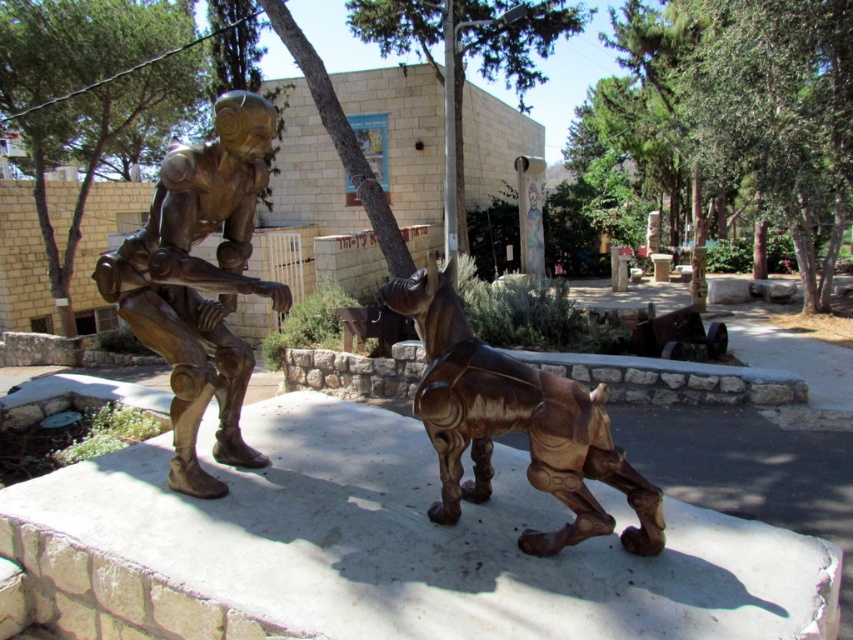
Question: Can you confirm if bronze statue at left is smaller than bronze/wooden dog at center?

Choices:
 (A) no
 (B) yes

Answer: (A)

Question: Which point is closer to the camera taking this photo?

Choices:
 (A) (440, 433)
 (B) (254, 188)

Answer: (A)

Question: Which object appears farthest from the camera in this image?

Choices:
 (A) bronze/wooden dog at center
 (B) bronze statue at left

Answer: (B)

Question: Can you confirm if bronze statue at left is positioned to the left of bronze/wooden dog at center?

Choices:
 (A) yes
 (B) no

Answer: (A)

Question: Where is bronze statue at left located in relation to bronze/wooden dog at center in the image?

Choices:
 (A) left
 (B) right

Answer: (A)

Question: Which point is farther from the camera taking this photo?

Choices:
 (A) (213, 490)
 (B) (428, 433)

Answer: (A)